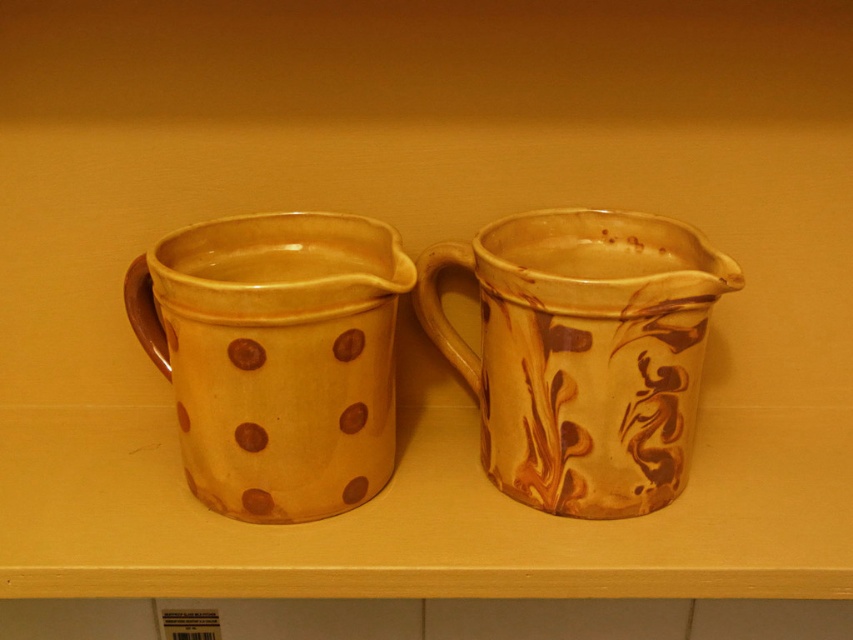
Question: Which of the following is the farthest from the observer?

Choices:
 (A) matte yellow clay mug at left
 (B) marbled clay pitcher at right

Answer: (B)

Question: Among these points, which one is farthest from the camera?

Choices:
 (A) (158, 323)
 (B) (698, 236)

Answer: (A)

Question: Can you confirm if matte yellow clay mug at left is bigger than marbled clay pitcher at right?

Choices:
 (A) yes
 (B) no

Answer: (B)

Question: Can you confirm if matte yellow clay mug at left is positioned below marbled clay pitcher at right?

Choices:
 (A) yes
 (B) no

Answer: (A)

Question: Is matte yellow clay mug at left above marbled clay pitcher at right?

Choices:
 (A) yes
 (B) no

Answer: (B)